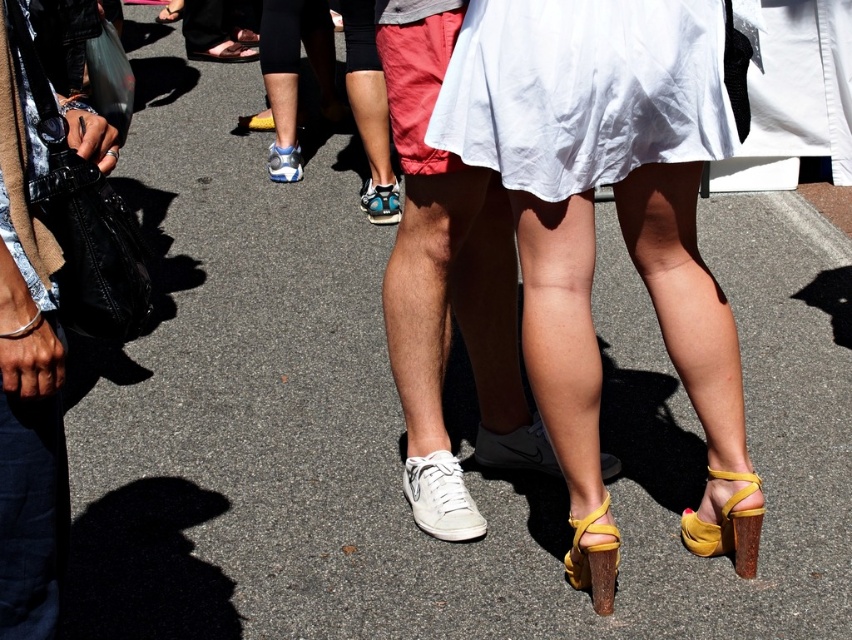
Which of these two, white leather shoe at center or white leather sneaker at center, stands shorter?

Standing shorter between the two is white leather shoe at center.

Between white leather shoe at center and white leather sneaker at center, which one appears on the right side from the viewer's perspective?

Positioned to the right is white leather shoe at center.

Who is more distant from viewer, (616,460) or (289,145)?

Point (289,145)

I want to click on white leather shoe at center, so click(516, 449).

Is point (714, 532) farther from viewer compared to point (600, 468)?

No, (714, 532) is closer to viewer.

At what (x,y) coordinates should I click in order to perform the action: click on matte yellow sandal at lower right. Please return your answer as a coordinate pair (x, y). Image resolution: width=852 pixels, height=640 pixels. Looking at the image, I should click on (727, 525).

Between denim pants at left and white leather shoe at center, which one is positioned higher?

denim pants at left

Looking at this image, between denim pants at left and white leather shoe at center, which one has more height?

Standing taller between the two is denim pants at left.

Between point (9, 220) and point (505, 468), which one is positioned behind?

Point (505, 468)

Where is `denim pants at left`? The image size is (852, 640). denim pants at left is located at coordinates (27, 374).